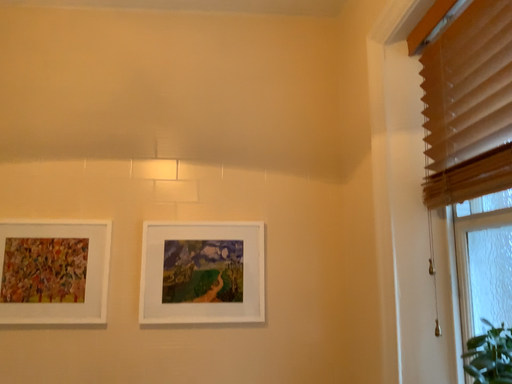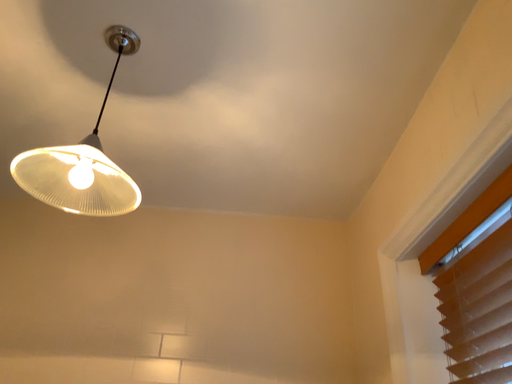
Question: How did the camera likely rotate when shooting the video?

Choices:
 (A) rotated upward
 (B) rotated downward

Answer: (A)